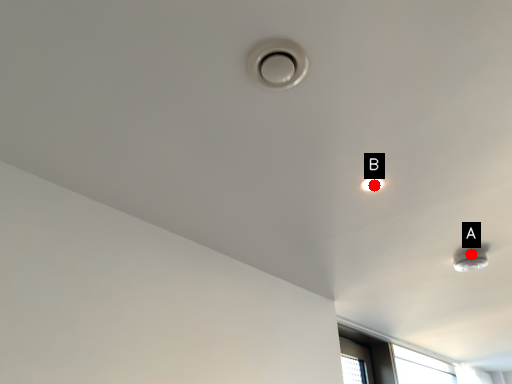
Question: Two points are circled on the image, labeled by A and B beside each circle. Which of the following is the farthest from the observer?

Choices:
 (A) A is further
 (B) B is further

Answer: (A)